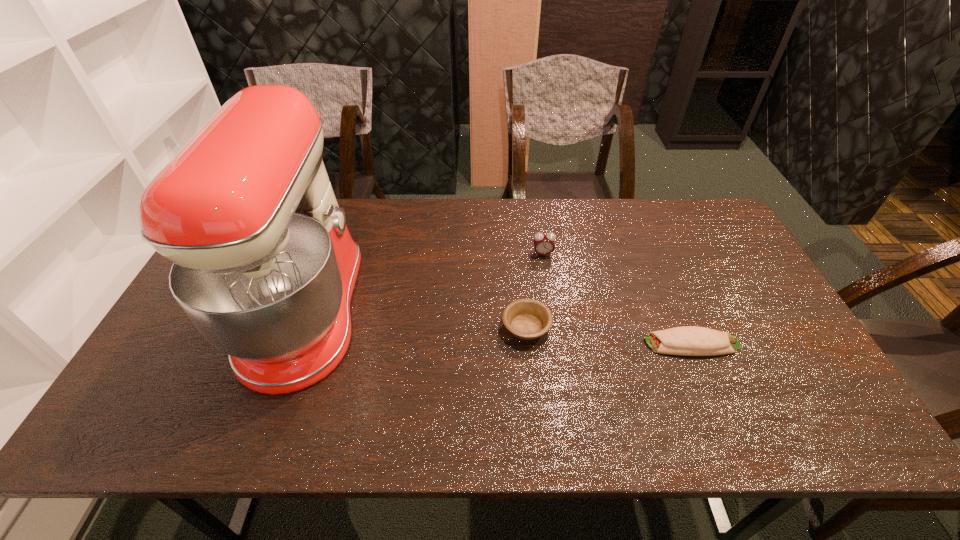
Find the location of a particular element. vacant space located at the bitten end of the shortest object is located at coordinates (548, 344).

I want to click on vacant space located 0.080m at the bitten end of the shortest object, so click(613, 344).

At what (x,y) coordinates should I click in order to perform the action: click on object located in the right edge section of the desktop. Please return your answer as a coordinate pair (x, y). The height and width of the screenshot is (540, 960). Looking at the image, I should click on (688, 340).

In order to click on free space at the far edge of the desktop in this screenshot , I will do `click(443, 204)`.

Image resolution: width=960 pixels, height=540 pixels. Identify the location of vacant region at the near edge of the desktop. click(x=517, y=423).

Locate an element on the screen. The width and height of the screenshot is (960, 540). vacant space at the right edge is located at coordinates (737, 251).

Image resolution: width=960 pixels, height=540 pixels. What are the coordinates of `vacant space at the far right corner of the desktop` in the screenshot? It's located at (682, 205).

The width and height of the screenshot is (960, 540). I want to click on empty space that is in between the alarm clock and the shortest object, so tap(617, 299).

In order to click on free space between the rightmost object and the alarm clock in this screenshot , I will do `click(617, 299)`.

Identify the location of free spot between the rightmost object and the leftmost object. Image resolution: width=960 pixels, height=540 pixels. (499, 328).